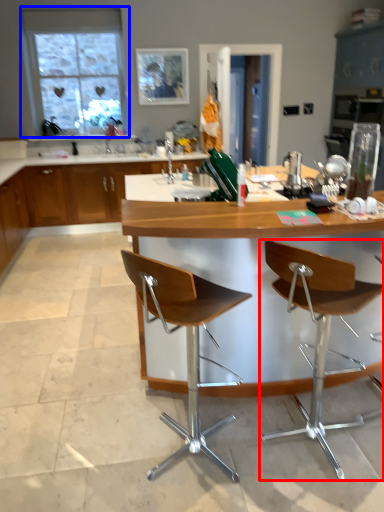
Question: Which of the following is the closest to the observer, chair (highlighted by a red box) or window (highlighted by a blue box)?

Choices:
 (A) chair
 (B) window

Answer: (A)